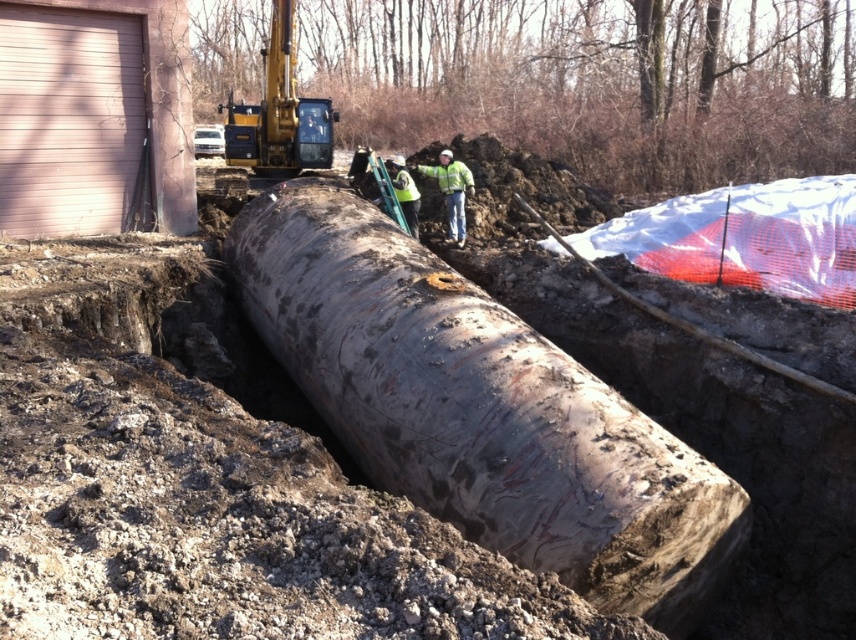
Does point (440, 387) come behind point (395, 163)?

No, it is in front of (395, 163).

Between rusty metallic water pipe at center and green reflective vest at center, which one is positioned lower?

Positioned lower is rusty metallic water pipe at center.

Who is more distant from viewer, (560, 480) or (389, 173)?

The point (389, 173) is more distant.

Locate an element on the screen. This screenshot has height=640, width=856. rusty metallic water pipe at center is located at coordinates (480, 410).

Can you confirm if yellow metallic excavator at upper center is positioned above high visibility yellow jacket at center?

Answer: Indeed, yellow metallic excavator at upper center is positioned over high visibility yellow jacket at center.

Measure the distance between yellow metallic excavator at upper center and camera.

They are 14.68 meters apart.

Where is `yellow metallic excavator at upper center`? The width and height of the screenshot is (856, 640). yellow metallic excavator at upper center is located at coordinates (278, 113).

Does high visibility yellow jacket at center have a lesser width compared to green reflective vest at center?

Yes, high visibility yellow jacket at center is thinner than green reflective vest at center.

Measure the distance from high visibility yellow jacket at center to green reflective vest at center.

3.54 feet

The image size is (856, 640). Identify the location of high visibility yellow jacket at center. (450, 192).